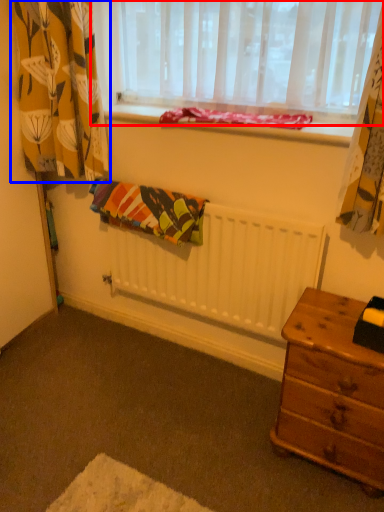
Question: Which object is closer to the camera taking this photo, window (highlighted by a red box) or curtain (highlighted by a blue box)?

Choices:
 (A) window
 (B) curtain

Answer: (A)